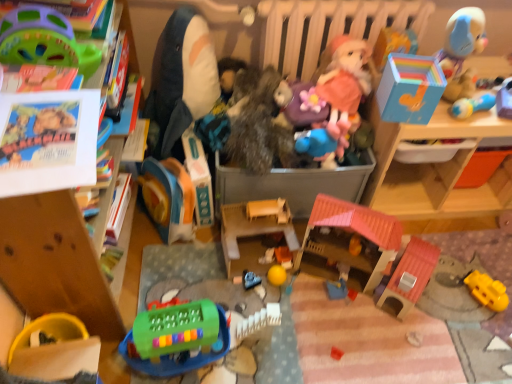
You are a GUI agent. You are given a task and a screenshot of the screen. Output one action in this format:
    pyautogui.click(x=<x>, y=<y>)
    Task: Click on the free spot in front of yellow rubber ball at center, the ninth toy when ordered from left to right
    
    Given the screenshot: What is the action you would take?
    pyautogui.click(x=271, y=329)